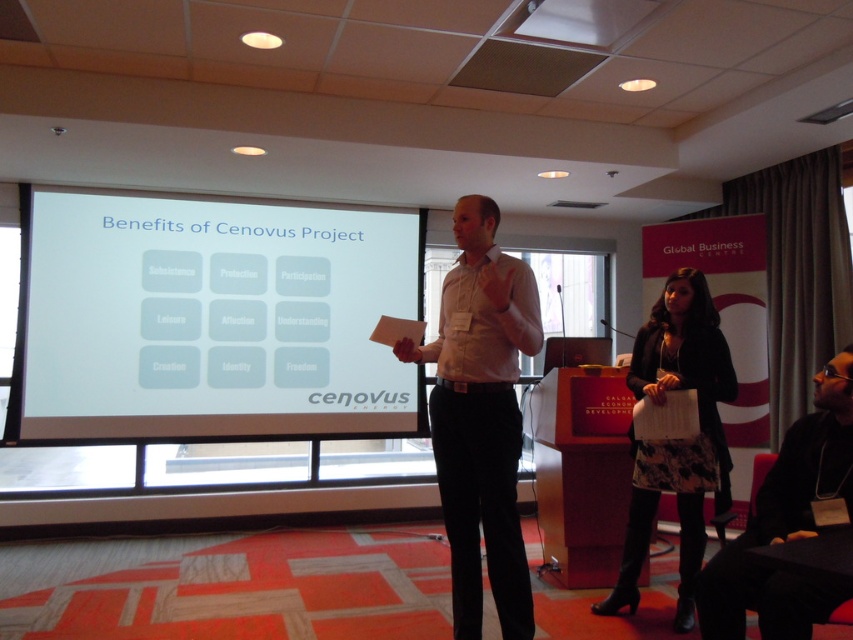
Question: Is white matte projection screen at center wider than black fabric jacket at lower right?

Choices:
 (A) no
 (B) yes

Answer: (B)

Question: Is white matte projection screen at center closer to camera compared to leopard print skirt at center?

Choices:
 (A) no
 (B) yes

Answer: (A)

Question: Can you confirm if white matte projection screen at center is wider than white shirt at center?

Choices:
 (A) no
 (B) yes

Answer: (B)

Question: Which object is positioned closest to the leopard print skirt at center?

Choices:
 (A) white shirt at center
 (B) black fabric jacket at lower right

Answer: (B)

Question: Estimate the real-world distances between objects in this image. Which object is farther from the white matte projection screen at center?

Choices:
 (A) white shirt at center
 (B) black fabric jacket at lower right
 (C) leopard print skirt at center

Answer: (B)

Question: Considering the real-world distances, which object is farthest from the white shirt at center?

Choices:
 (A) white matte projection screen at center
 (B) black fabric jacket at lower right
 (C) leopard print skirt at center

Answer: (A)